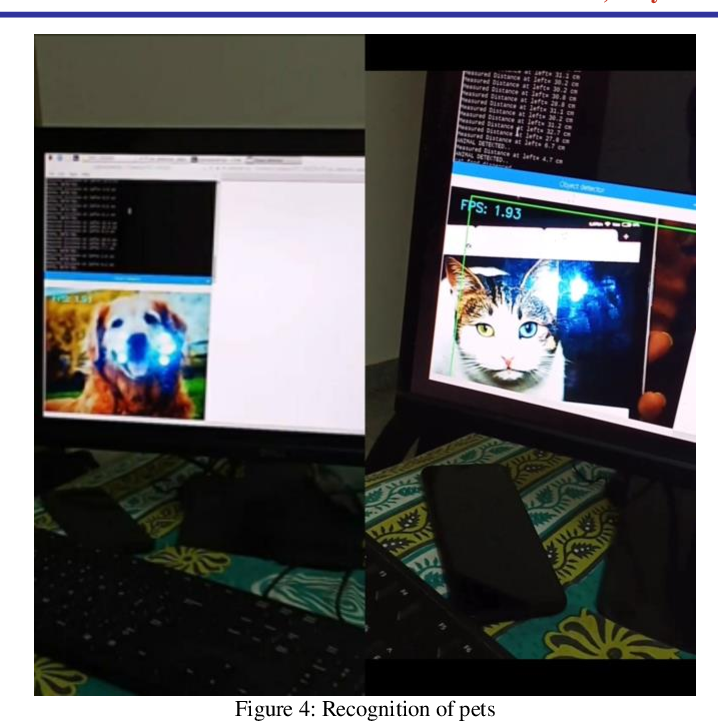
In order to click on keyboard in this screenshot , I will do `click(228, 624)`.